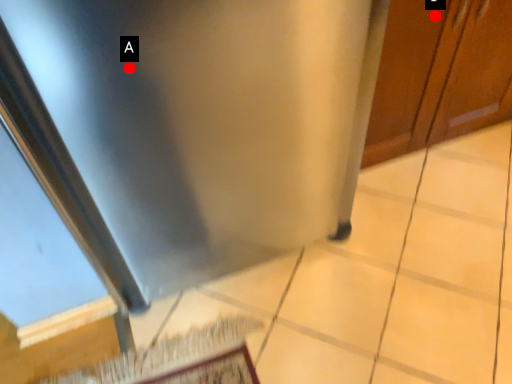
Question: Two points are circled on the image, labeled by A and B beside each circle. Which of the following is the closest to the observer?

Choices:
 (A) A is closer
 (B) B is closer

Answer: (A)